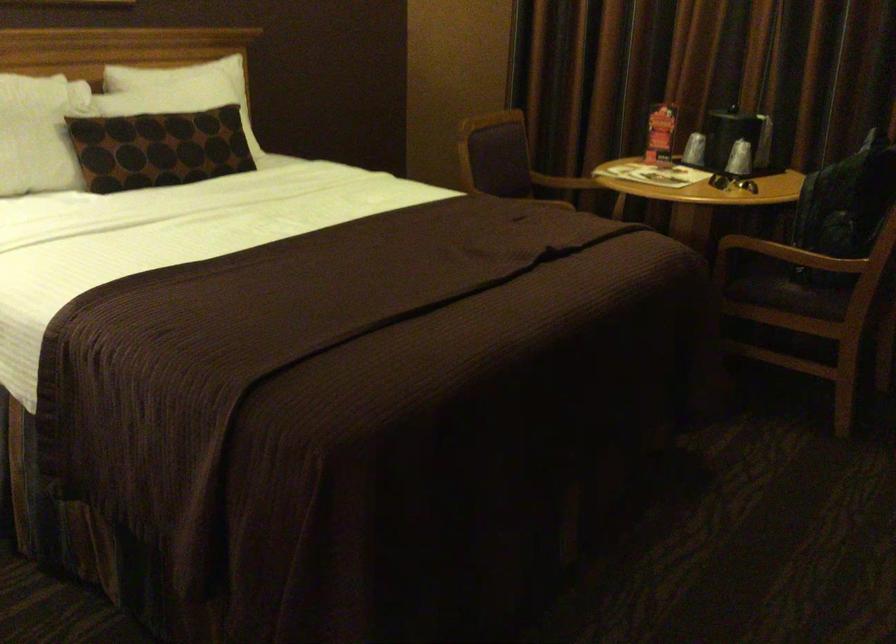
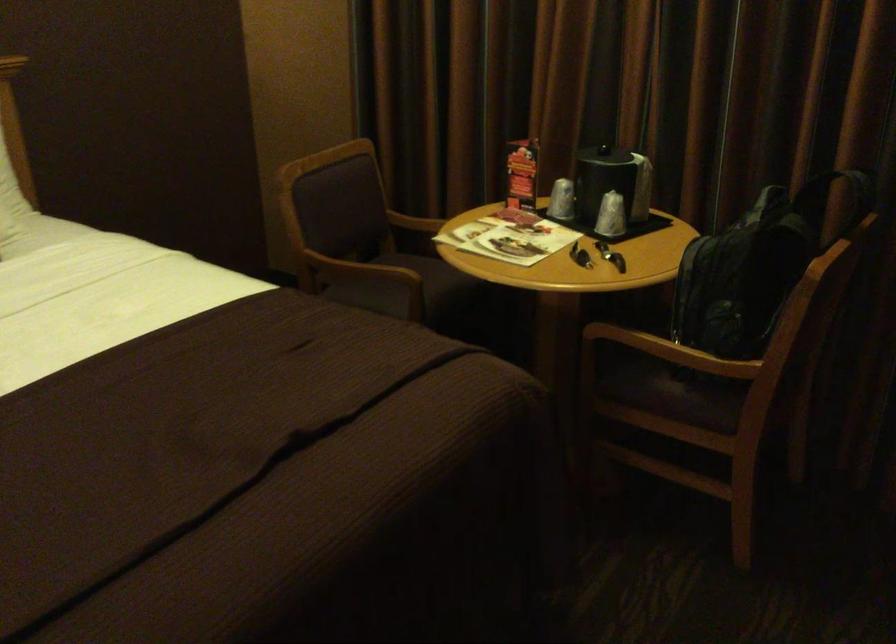
In the second image, find the point that corresponds to point (739, 156) in the first image.

(610, 216)